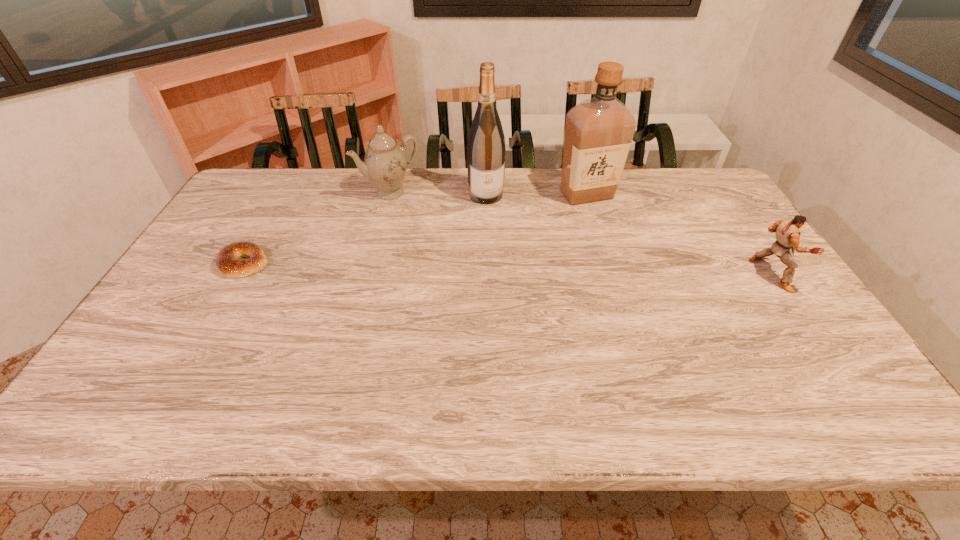
Locate an element on the screen. wine bottle at the far edge is located at coordinates (486, 150).

The height and width of the screenshot is (540, 960). I want to click on object situated at the left edge, so click(x=228, y=261).

This screenshot has width=960, height=540. I want to click on object at the right edge, so click(x=787, y=231).

This screenshot has width=960, height=540. Find the location of `vacant region at the far edge`. vacant region at the far edge is located at coordinates (511, 171).

What are the coordinates of `vacant point at the near edge` in the screenshot? It's located at (344, 355).

At what (x,y) coordinates should I click in order to perform the action: click on vacant region at the left edge. Please return your answer as a coordinate pair (x, y). The width and height of the screenshot is (960, 540). Looking at the image, I should click on (194, 286).

Identify the location of free location at the near right corner of the desktop. This screenshot has height=540, width=960. (772, 365).

Where is `unoccupied position between the third object from left to right and the third tallest object`? This screenshot has height=540, width=960. unoccupied position between the third object from left to right and the third tallest object is located at coordinates (438, 194).

Find the location of a particular element. This screenshot has width=960, height=540. free spot between the third object from right to left and the second shortest object is located at coordinates (629, 235).

At what (x,y) coordinates should I click in order to perform the action: click on free point between the second object from right to left and the leftmost object. Please return your answer as a coordinate pair (x, y). This screenshot has width=960, height=540. Looking at the image, I should click on (416, 229).